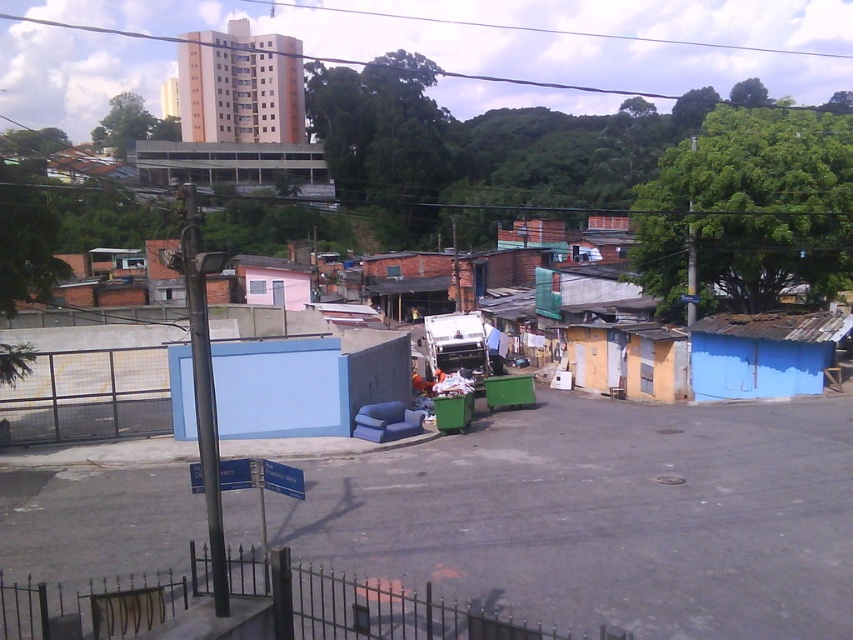
Question: From the image, what is the correct spatial relationship of beige concrete building at upper left in relation to blue corrugated metal hut at right?

Choices:
 (A) above
 (B) below

Answer: (A)

Question: Which object appears closest to the camera in this image?

Choices:
 (A) green corrugated metal building at upper center
 (B) blue corrugated metal hut at right

Answer: (B)

Question: From the image, what is the correct spatial relationship of beige concrete building at upper left in relation to green corrugated metal building at upper center?

Choices:
 (A) below
 (B) above

Answer: (B)

Question: Estimate the real-world distances between objects in this image. Which object is closer to the beige concrete building at upper left?

Choices:
 (A) blue corrugated metal hut at right
 (B) green corrugated metal building at upper center

Answer: (B)

Question: Which object is the closest to the beige concrete building at upper left?

Choices:
 (A) green corrugated metal building at upper center
 (B) blue corrugated metal hut at right

Answer: (A)

Question: Is beige concrete building at upper left below blue corrugated metal hut at right?

Choices:
 (A) no
 (B) yes

Answer: (A)